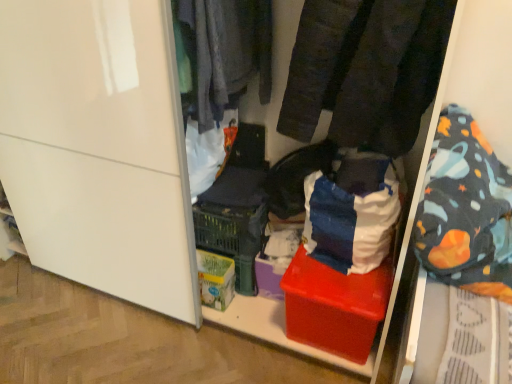
What is the approximate height of red plastic box at center?

The height of red plastic box at center is 11.64 inches.

Describe the element at coordinates (275, 82) in the screenshot. This screenshot has width=512, height=384. I see `red plastic storage bin at center` at that location.

Locate an element on the screen. green cardboard box at center is located at coordinates (215, 279).

I want to click on dark gray fabric at upper center, which appears as the 2th clothing when viewed from the right, so click(224, 53).

This screenshot has width=512, height=384. In order to click on clothing below the dark gray fabric at upper center, the first clothing in the left-to-right sequence (from the image's perspective) in this screenshot , I will do `click(366, 70)`.

From the image's perspective, relative to dark gray fabric at upper center, the first clothing in the left-to-right sequence, is velvet-like black pants at center, the second clothing when ordered from left to right, above or below?

Clearly, from the image's perspective, velvet-like black pants at center, the second clothing when ordered from left to right, is below dark gray fabric at upper center, the first clothing in the left-to-right sequence.

In the scene shown: Who is smaller, velvet-like black pants at center, the second clothing when ordered from left to right, or dark gray fabric at upper center, the first clothing in the left-to-right sequence?

Smaller between the two is dark gray fabric at upper center, the first clothing in the left-to-right sequence.

Between green cardboard box at center and dark gray fabric at upper center, which appears as the 2th clothing when viewed from the right, which one has less height?

green cardboard box at center is shorter.

From a real-world perspective, between green cardboard box at center and dark gray fabric at upper center, the first clothing in the left-to-right sequence, who is vertically higher?

In real-world perspective, dark gray fabric at upper center, the first clothing in the left-to-right sequence, is above.

From the image's perspective, relative to dark gray fabric at upper center, the first clothing in the left-to-right sequence, is green cardboard box at center above or below?

From the image's perspective, green cardboard box at center appears below dark gray fabric at upper center, the first clothing in the left-to-right sequence.

How far apart are velvet-like black pants at center, the 1th clothing viewed from the right, and green cardboard box at center?

velvet-like black pants at center, the 1th clothing viewed from the right, and green cardboard box at center are 34.49 inches apart.

Could you tell me if velvet-like black pants at center, the 1th clothing viewed from the right, is turned towards green cardboard box at center?

No, velvet-like black pants at center, the 1th clothing viewed from the right, does not turn towards green cardboard box at center.

From a real-world perspective, which is physically below, velvet-like black pants at center, the 1th clothing viewed from the right, or green cardboard box at center?

From a 3D spatial view, green cardboard box at center is below.

Between point (310, 92) and point (209, 264), which one is positioned behind?

The point (209, 264) is farther from the camera.

From the picture: Is dark gray fabric at upper center, the first clothing in the left-to-right sequence, positioned beyond the bounds of red plastic storage bin at center?

No, dark gray fabric at upper center, the first clothing in the left-to-right sequence, is inside red plastic storage bin at center's boundary.

From a real-world perspective, does dark gray fabric at upper center, which appears as the 2th clothing when viewed from the right, sit lower than red plastic storage bin at center?

Incorrect, from a real-world perspective, dark gray fabric at upper center, which appears as the 2th clothing when viewed from the right, is higher than red plastic storage bin at center.

Where is `shelf below the dark gray fabric at upper center, which appears as the 2th clothing when viewed from the right (from the image's perspective)`? Image resolution: width=512 pixels, height=384 pixels. shelf below the dark gray fabric at upper center, which appears as the 2th clothing when viewed from the right (from the image's perspective) is located at coordinates (275, 82).

Is point (229, 10) farther from camera compared to point (424, 141)?

Yes.

Looking at this image, from the image's perspective, between dark gray fabric at upper center, which appears as the 2th clothing when viewed from the right, and velvet-like black pants at center, the 1th clothing viewed from the right, who is located below?

velvet-like black pants at center, the 1th clothing viewed from the right, from the image's perspective.

Is point (237, 98) closer to viewer compared to point (324, 76)?

That is False.

Considering the relative sizes of dark gray fabric at upper center, which appears as the 2th clothing when viewed from the right, and velvet-like black pants at center, the second clothing when ordered from left to right, in the image provided, is dark gray fabric at upper center, which appears as the 2th clothing when viewed from the right, wider than velvet-like black pants at center, the second clothing when ordered from left to right,?

No, dark gray fabric at upper center, which appears as the 2th clothing when viewed from the right, is not wider than velvet-like black pants at center, the second clothing when ordered from left to right.

From a real-world perspective, is dark gray fabric at upper center, which appears as the 2th clothing when viewed from the right, above or below velvet-like black pants at center, the 1th clothing viewed from the right?

dark gray fabric at upper center, which appears as the 2th clothing when viewed from the right, is below velvet-like black pants at center, the 1th clothing viewed from the right.

Between red plastic storage bin at center and red plastic box at center, which one has smaller width?

red plastic box at center.

Looking at this image, is red plastic storage bin at center positioned with its back to red plastic box at center?

Yes, red plastic storage bin at center is facing away from red plastic box at center.

At what (x,y) coordinates should I click in order to perform the action: click on shelf on the left of red plastic box at center. Please return your answer as a coordinate pair (x, y). Looking at the image, I should click on (275, 82).

Is dark gray fabric at upper center, the first clothing in the left-to-right sequence, facing towards red plastic box at center?

No, dark gray fabric at upper center, the first clothing in the left-to-right sequence, does not turn towards red plastic box at center.

Which of these two, dark gray fabric at upper center, which appears as the 2th clothing when viewed from the right, or red plastic box at center, stands shorter?

red plastic box at center is shorter.

Consider the image. Considering the relative sizes of dark gray fabric at upper center, which appears as the 2th clothing when viewed from the right, and red plastic box at center in the image provided, is dark gray fabric at upper center, which appears as the 2th clothing when viewed from the right, bigger than red plastic box at center?

No, dark gray fabric at upper center, which appears as the 2th clothing when viewed from the right, is not bigger than red plastic box at center.

Is dark gray fabric at upper center, the first clothing in the left-to-right sequence, far away from red plastic box at center?

No, dark gray fabric at upper center, the first clothing in the left-to-right sequence, is not far away from red plastic box at center.

You are a GUI agent. You are given a task and a screenshot of the screen. Output one action in this format:
    pyautogui.click(x=<x>, y=<y>)
    Task: Click on the clothing behind the velvet-like black pants at center, the 1th clothing viewed from the right
    This screenshot has width=512, height=384.
    Given the screenshot: What is the action you would take?
    pyautogui.click(x=224, y=53)

The image size is (512, 384). What are the coordinates of `cardboard box directly beneath the dark gray fabric at upper center, the first clothing in the left-to-right sequence (from a real-world perspective)` in the screenshot? It's located at (215, 279).

From the image, which object appears to be nearer to dark gray fabric at upper center, which appears as the 2th clothing when viewed from the right, red plastic storage bin at center or red plastic box at center?

red plastic storage bin at center.

From the image, which object appears to be farther from red plastic box at center, red plastic storage bin at center or velvet-like black pants at center, the 1th clothing viewed from the right?

red plastic storage bin at center is further to red plastic box at center.

Considering their positions, is green cardboard box at center positioned further to red plastic box at center than velvet-like black pants at center, the second clothing when ordered from left to right?

velvet-like black pants at center, the second clothing when ordered from left to right, is further to red plastic box at center.

From the image, which object appears to be nearer to dark gray fabric at upper center, which appears as the 2th clothing when viewed from the right, green cardboard box at center or velvet-like black pants at center, the 1th clothing viewed from the right?

Based on the image, velvet-like black pants at center, the 1th clothing viewed from the right, appears to be nearer to dark gray fabric at upper center, which appears as the 2th clothing when viewed from the right.

Which object lies further to the anchor point red plastic storage bin at center, red plastic box at center or velvet-like black pants at center, the 1th clothing viewed from the right?

Based on the image, red plastic box at center appears to be further to red plastic storage bin at center.

Which object lies further to the anchor point green cardboard box at center, dark gray fabric at upper center, the first clothing in the left-to-right sequence, or red plastic box at center?

dark gray fabric at upper center, the first clothing in the left-to-right sequence.

Which object lies further to the anchor point red plastic storage bin at center, green cardboard box at center or velvet-like black pants at center, the 1th clothing viewed from the right?

green cardboard box at center is positioned further to the anchor red plastic storage bin at center.

When comparing their distances from green cardboard box at center, does red plastic storage bin at center or velvet-like black pants at center, the second clothing when ordered from left to right, seem further?

The object further to green cardboard box at center is velvet-like black pants at center, the second clothing when ordered from left to right.

Find the location of `clothing between dark gray fabric at upper center, which appears as the 2th clothing when viewed from the right, and green cardboard box at center, in the vertical direction`. clothing between dark gray fabric at upper center, which appears as the 2th clothing when viewed from the right, and green cardboard box at center, in the vertical direction is located at coordinates (366, 70).

You are a GUI agent. You are given a task and a screenshot of the screen. Output one action in this format:
    pyautogui.click(x=<x>, y=<y>)
    Task: Click on the box between velvet-like black pants at center, the second clothing when ordered from left to right, and green cardboard box at center from top to bottom
    This screenshot has height=384, width=512.
    Given the screenshot: What is the action you would take?
    pyautogui.click(x=335, y=306)

Locate an element on the screen. box between red plastic storage bin at center and velvet-like black pants at center, the second clothing when ordered from left to right is located at coordinates (335, 306).

The height and width of the screenshot is (384, 512). Find the location of `box between red plastic storage bin at center and green cardboard box at center along the z-axis`. box between red plastic storage bin at center and green cardboard box at center along the z-axis is located at coordinates (335, 306).